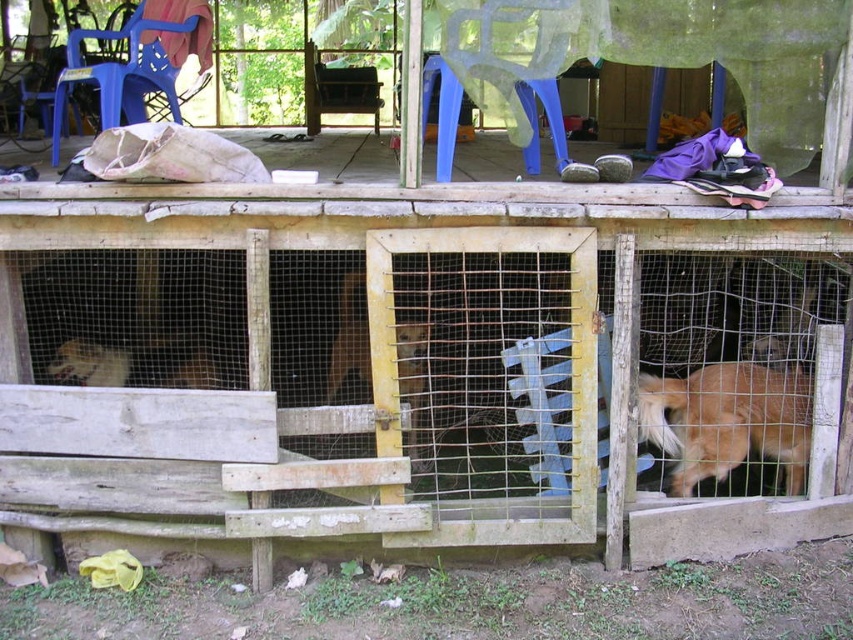
Question: Can you confirm if wooden wire cage at center is smaller than golden fur dog at lower right?

Choices:
 (A) no
 (B) yes

Answer: (A)

Question: Does wooden wire cage at center have a smaller size compared to golden fur dog at lower right?

Choices:
 (A) no
 (B) yes

Answer: (A)

Question: Which point is closer to the camera taking this photo?

Choices:
 (A) (724, 378)
 (B) (698, 244)

Answer: (B)

Question: Is wooden wire cage at center to the right of golden fur dog at lower right from the viewer's perspective?

Choices:
 (A) yes
 (B) no

Answer: (B)

Question: Which of the following is the closest to the observer?

Choices:
 (A) (743, 458)
 (B) (607, 448)

Answer: (B)

Question: Which object appears closest to the camera in this image?

Choices:
 (A) golden fur dog at lower right
 (B) wooden wire cage at center

Answer: (B)